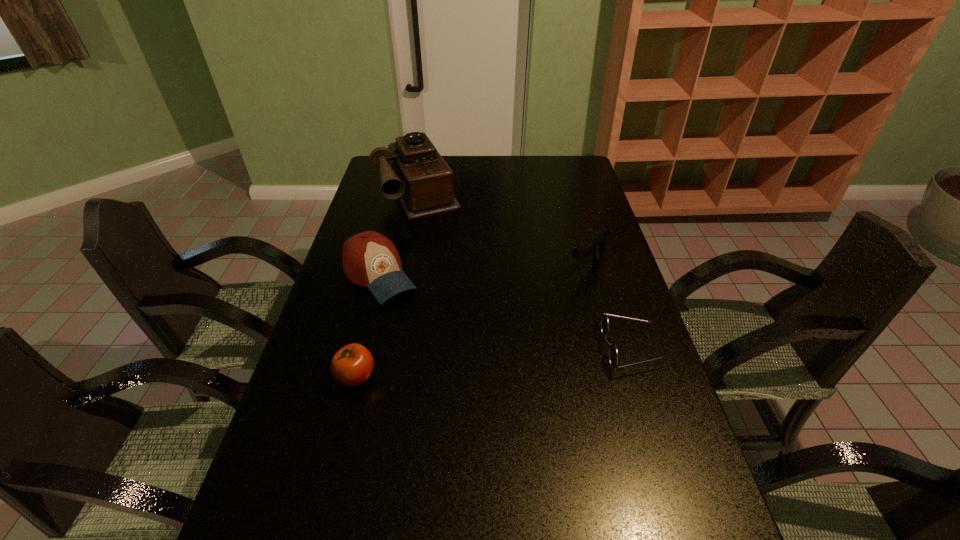
Find the location of a particular element. The image size is (960, 540). vacant spot on the desktop that is between the apple and the shortest object and is positioned on the front-facing side of the pistol is located at coordinates (468, 366).

This screenshot has height=540, width=960. What are the coordinates of `vacant space on the desktop that is between the apple and the shortest object and is positioned on the horn of the phonograph_record` in the screenshot? It's located at (516, 361).

Identify the location of free space on the desktop that is between the apple and the shortest object and is positioned on the front-facing side of the baseball cap. (458, 367).